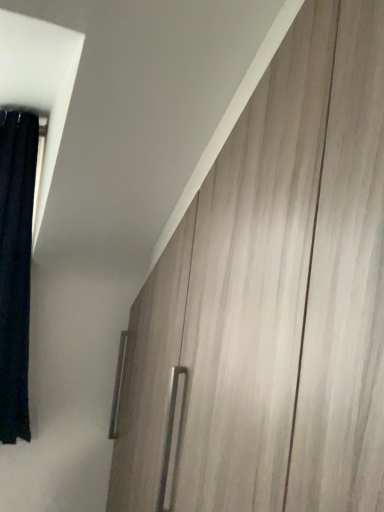
What is the approximate width of wooden cabinet at right?

wooden cabinet at right is 5.56 centimeters wide.

Image resolution: width=384 pixels, height=512 pixels. What do you see at coordinates (270, 300) in the screenshot?
I see `wooden cabinet at right` at bounding box center [270, 300].

In order to click on wooden cabinet at right in this screenshot , I will do `click(270, 300)`.

The height and width of the screenshot is (512, 384). What do you see at coordinates (16, 267) in the screenshot? I see `black fabric curtain at left` at bounding box center [16, 267].

Image resolution: width=384 pixels, height=512 pixels. In order to click on black fabric curtain at left in this screenshot , I will do point(16,267).

Find the location of a particular element. Image resolution: width=384 pixels, height=512 pixels. wooden cabinet at right is located at coordinates (270, 300).

Does wooden cabinet at right appear on the left side of black fabric curtain at left?

No, wooden cabinet at right is not to the left of black fabric curtain at left.

Is wooden cabinet at right positioned before black fabric curtain at left?

Yes, wooden cabinet at right is closer to the camera.

Is point (211, 485) positioned in front of point (5, 112)?

Yes, point (211, 485) is in front of point (5, 112).

From the image's perspective, who appears lower, wooden cabinet at right or black fabric curtain at left?

wooden cabinet at right, from the image's perspective.

From a real-world perspective, is wooden cabinet at right physically below black fabric curtain at left?

Indeed, from a real-world perspective, wooden cabinet at right is positioned beneath black fabric curtain at left.

Between wooden cabinet at right and black fabric curtain at left, which one has smaller width?

wooden cabinet at right is thinner.

Who is taller, wooden cabinet at right or black fabric curtain at left?

With more height is wooden cabinet at right.

Does wooden cabinet at right have a smaller size compared to black fabric curtain at left?

No, wooden cabinet at right is not smaller than black fabric curtain at left.

Do you think wooden cabinet at right is within black fabric curtain at left, or outside of it?

wooden cabinet at right exists outside the volume of black fabric curtain at left.

Would you say wooden cabinet at right is a long distance from black fabric curtain at left?

No, wooden cabinet at right is not far away from black fabric curtain at left.

Is black fabric curtain at left at the back of wooden cabinet at right?

wooden cabinet at right does not have its back to black fabric curtain at left.

Measure the distance between wooden cabinet at right and black fabric curtain at left.

A distance of 82.22 centimeters exists between wooden cabinet at right and black fabric curtain at left.

In the image, there is a black fabric curtain at left. Where is `barn door below it (from a real-world perspective)`? The width and height of the screenshot is (384, 512). barn door below it (from a real-world perspective) is located at coordinates (270, 300).

Between black fabric curtain at left and wooden cabinet at right, which one appears on the right side from the viewer's perspective?

Positioned to the right is wooden cabinet at right.

Based on the photo, considering the positions of objects black fabric curtain at left and wooden cabinet at right in the image provided, who is in front, black fabric curtain at left or wooden cabinet at right?

Positioned in front is wooden cabinet at right.

Is point (1, 133) farther from camera compared to point (299, 399)?

Yes, it is.

From the image's perspective, would you say black fabric curtain at left is shown under wooden cabinet at right?

Incorrect, from the image's perspective, black fabric curtain at left is higher than wooden cabinet at right.

From a real-world perspective, is black fabric curtain at left over wooden cabinet at right?

Indeed, from a real-world perspective, black fabric curtain at left stands above wooden cabinet at right.

Which of these two, black fabric curtain at left or wooden cabinet at right, is thinner?

Thinner between the two is wooden cabinet at right.

Which of these two, black fabric curtain at left or wooden cabinet at right, stands shorter?

black fabric curtain at left.

Is black fabric curtain at left smaller than wooden cabinet at right?

Indeed, black fabric curtain at left has a smaller size compared to wooden cabinet at right.

Which is correct: black fabric curtain at left is inside wooden cabinet at right, or outside of it?

black fabric curtain at left is outside wooden cabinet at right.

Is the surface of black fabric curtain at left in direct contact with wooden cabinet at right?

black fabric curtain at left is not next to wooden cabinet at right, and they're not touching.

Could you tell me if black fabric curtain at left is turned towards wooden cabinet at right?

No, black fabric curtain at left is not aimed at wooden cabinet at right.

What's the angular difference between black fabric curtain at left and wooden cabinet at right's facing directions?

They differ by 90.1 degrees in their facing directions.

Measure the distance from black fabric curtain at left to wooden cabinet at right.

A distance of 32.37 inches exists between black fabric curtain at left and wooden cabinet at right.

What are the coordinates of `curtain that appears above the wooden cabinet at right (from a real-world perspective)` in the screenshot? It's located at (16, 267).

Image resolution: width=384 pixels, height=512 pixels. I want to click on barn door in front of the black fabric curtain at left, so click(270, 300).

This screenshot has height=512, width=384. There is a wooden cabinet at right. Identify the location of curtain above it (from a real-world perspective). (16, 267).